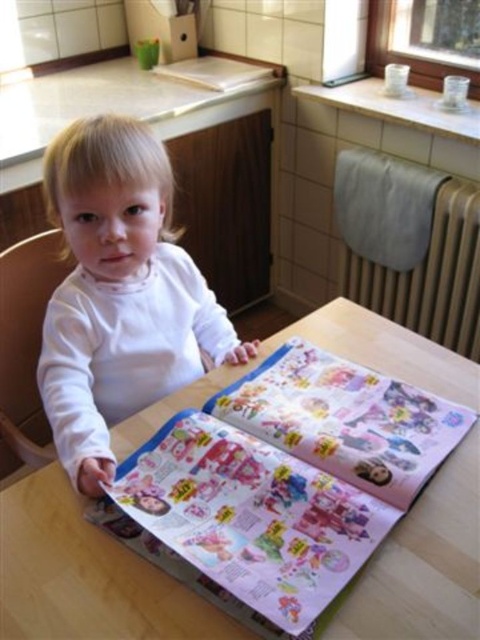
Can you confirm if wooden table at center is shorter than wooden chair at left?

Yes, wooden table at center is shorter than wooden chair at left.

Which of these two, wooden table at center or wooden chair at left, stands shorter?

With less height is wooden table at center.

Where is `wooden table at center`? The image size is (480, 640). wooden table at center is located at coordinates (85, 576).

Identify the location of wooden table at center. The image size is (480, 640). (85, 576).

Between wooden table at center and white matte toddler at center, which one is positioned lower?

Positioned lower is wooden table at center.

The height and width of the screenshot is (640, 480). Identify the location of wooden table at center. (85, 576).

Locate an element on the screen. The image size is (480, 640). wooden table at center is located at coordinates (85, 576).

Is point (72, 282) more distant than point (16, 307)?

No, (72, 282) is closer to viewer.

Who is lower down, white matte toddler at center or wooden chair at left?

Positioned lower is wooden chair at left.

Find the location of a particular element. This screenshot has height=640, width=480. white matte toddler at center is located at coordinates (119, 292).

The width and height of the screenshot is (480, 640). Identify the location of white matte toddler at center. (119, 292).